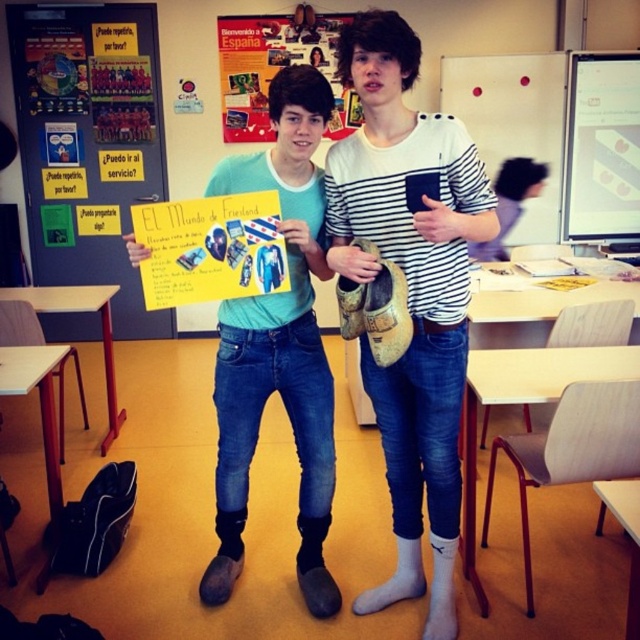
Does striped cotton shirt at center have a smaller size compared to whiteboard at upper center?

No, striped cotton shirt at center is not smaller than whiteboard at upper center.

Image resolution: width=640 pixels, height=640 pixels. What are the coordinates of `striped cotton shirt at center` in the screenshot? It's located at (410, 291).

I want to click on striped cotton shirt at center, so click(x=410, y=291).

Which is above, matte brown wooden shoes at center or yellow paper at center?

yellow paper at center is above.

Who is more forward, (346, 218) or (202, 198)?

Positioned in front is point (202, 198).

At what (x,y) coordinates should I click in order to perform the action: click on matte brown wooden shoes at center. Please return your answer as a coordinate pair (x, y). Looking at the image, I should click on (410, 291).

Which of these two, striped cotton shirt at center or matte paper poster at upper center, stands taller?

With more height is striped cotton shirt at center.

What do you see at coordinates (410, 291) in the screenshot?
I see `striped cotton shirt at center` at bounding box center [410, 291].

At what (x,y) coordinates should I click in order to perform the action: click on striped cotton shirt at center. Please return your answer as a coordinate pair (x, y). This screenshot has height=640, width=640. Looking at the image, I should click on (410, 291).